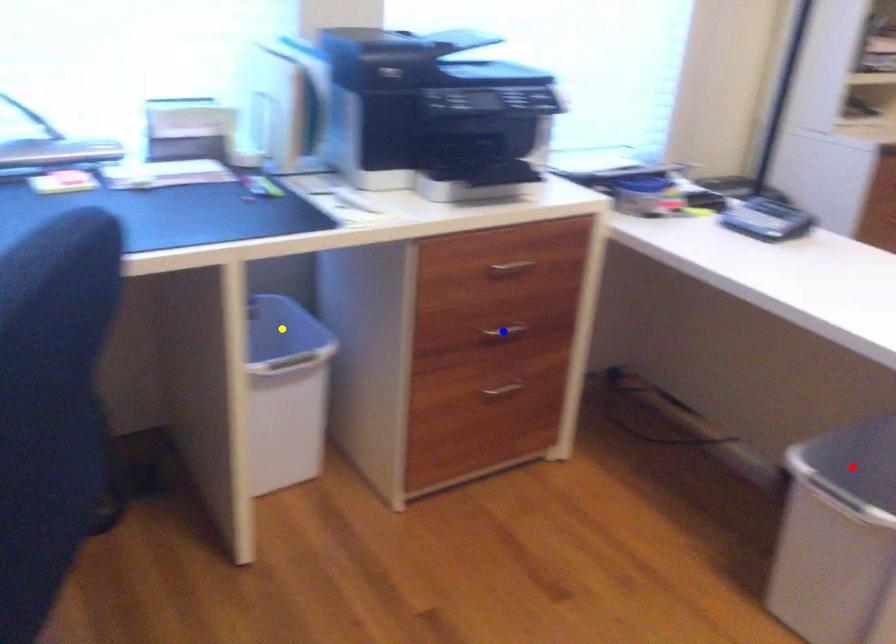
Order these from nearest to farthest:
A) yellow point
B) blue point
C) red point

red point, blue point, yellow point